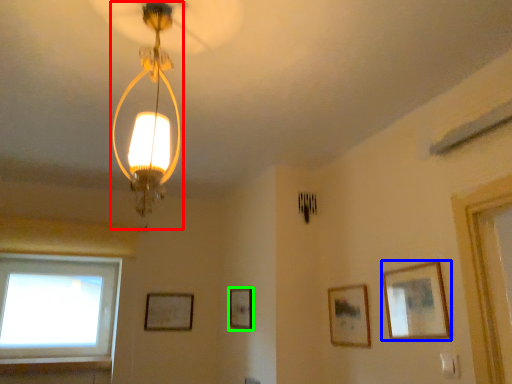
Question: Which object is the farthest from lamp (highlighted by a red box)? Choose among these: picture frame (highlighted by a blue box) or picture frame (highlighted by a green box).

Choices:
 (A) picture frame
 (B) picture frame

Answer: (B)